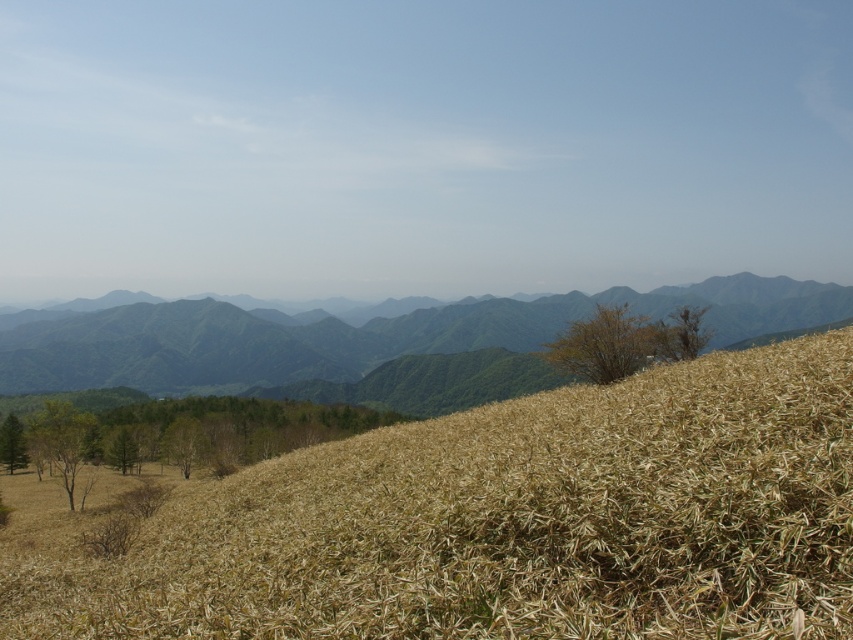
You are standing at the point closer to the camera in the image. Which point are you at, point (257, 332) or point (22, 461)?

You are at point (257, 332) because it is further to the camera than point (22, 461).

You are standing at the point marked by point (x=503, y=522) in the image. What type of terrain are you currently on?

You are standing on brown dry grass at center, as indicated by the point (x=503, y=522).

You are an artist planning to paint the landscape. You want to ensure the green textured mountains at center and the green matte tree at lower left are proportionally accurate. Which object should you draw larger on your canvas?

The green textured mountains at center should be drawn larger than the green matte tree at lower left because the description states that the green textured mountains at center is bigger than the green matte tree at lower left.